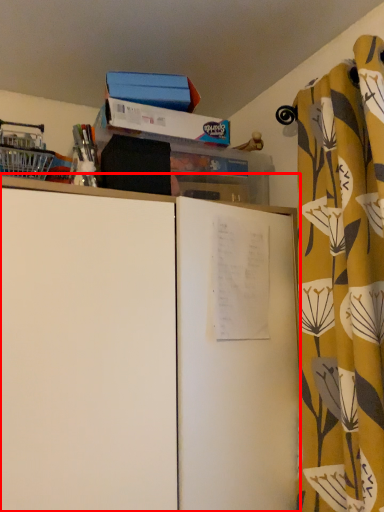
Question: From the image, what is the correct spatial relationship of cupboard (annotated by the red box) in relation to curtain?

Choices:
 (A) left
 (B) right

Answer: (A)